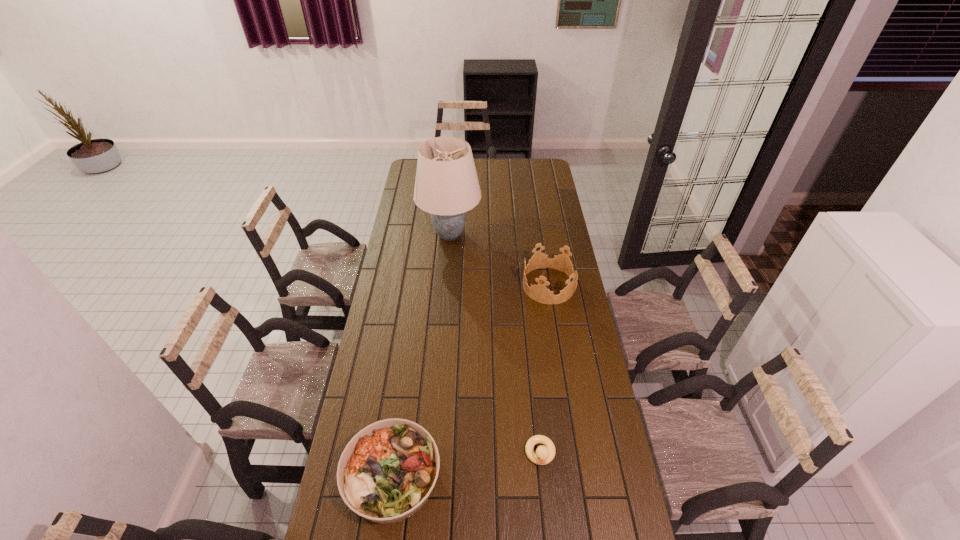
At what (x,y) coordinates should I click in order to perform the action: click on the farthest object. Please return your answer as a coordinate pair (x, y). The image size is (960, 540). Looking at the image, I should click on (446, 186).

Locate an element on the screen. This screenshot has width=960, height=540. lampshade is located at coordinates (446, 186).

Where is `tiara`? The height and width of the screenshot is (540, 960). tiara is located at coordinates (539, 292).

This screenshot has height=540, width=960. What are the coordinates of `the second farthest object` in the screenshot? It's located at (539, 292).

You are a GUI agent. You are given a task and a screenshot of the screen. Output one action in this format:
    pyautogui.click(x=<x>, y=<y>)
    Task: Click on the salad plate
    The image size is (960, 540).
    Given the screenshot: What is the action you would take?
    pyautogui.click(x=386, y=473)

The height and width of the screenshot is (540, 960). Find the location of `the shortest object`. the shortest object is located at coordinates (545, 454).

This screenshot has width=960, height=540. Find the location of `free point located 0.270m on the right of the farthest object`. free point located 0.270m on the right of the farthest object is located at coordinates (535, 235).

Where is `free space located on the front-facing side of the second tallest object`? This screenshot has width=960, height=540. free space located on the front-facing side of the second tallest object is located at coordinates (434, 285).

Locate an element on the screen. free space located 0.240m on the front-facing side of the second tallest object is located at coordinates (468, 285).

At what (x,y) coordinates should I click in order to perform the action: click on vacant space located 0.110m on the front-facing side of the second tallest object. Please return your answer as a coordinate pair (x, y). Image resolution: width=960 pixels, height=540 pixels. Looking at the image, I should click on (497, 285).